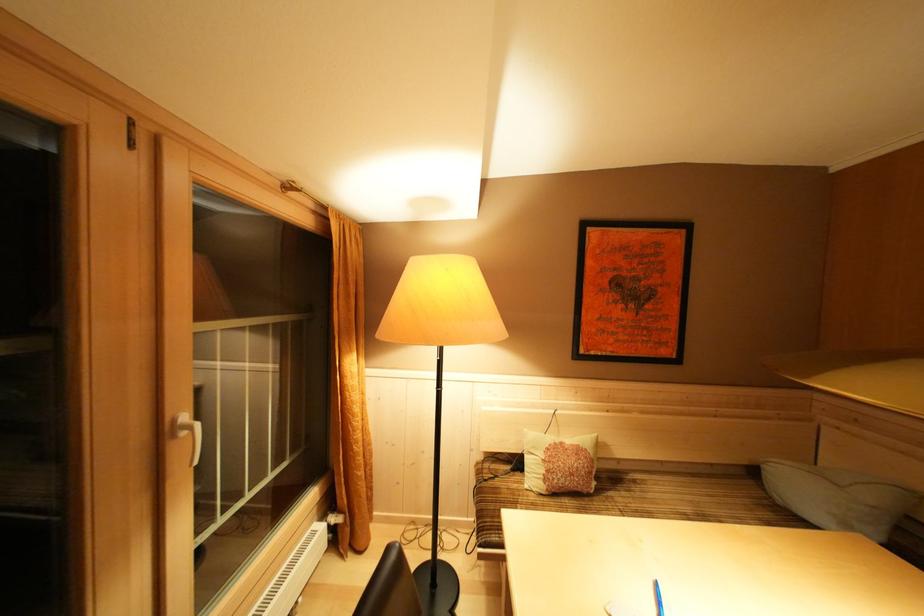
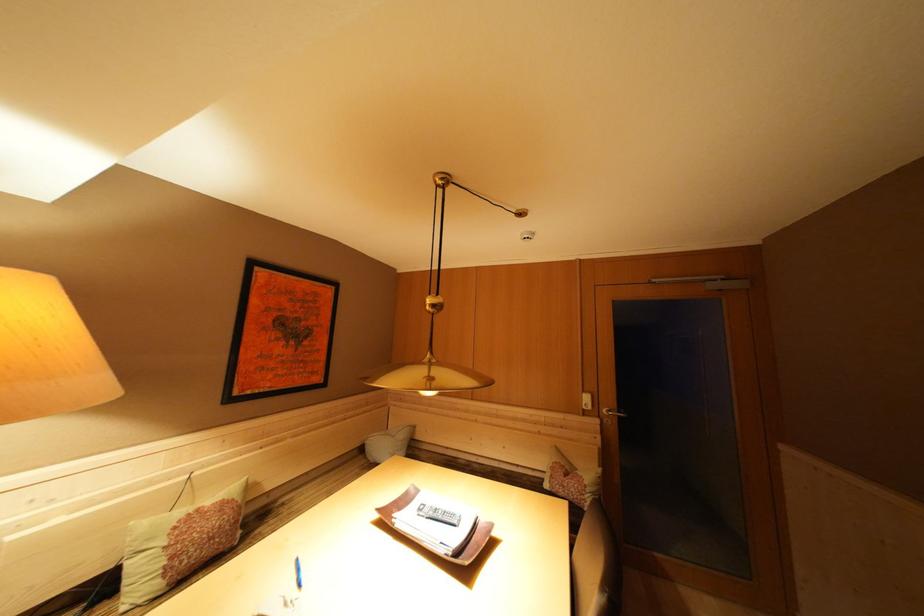
Where in the second image is the point corresponding to (879,503) from the first image?

(408, 440)